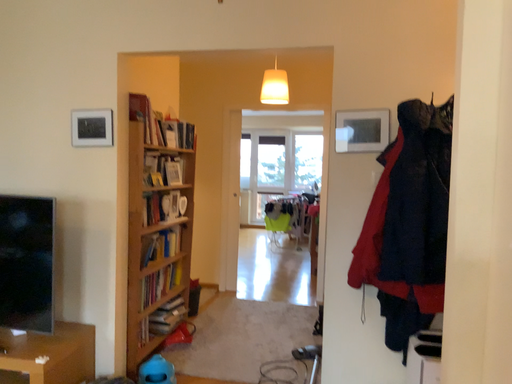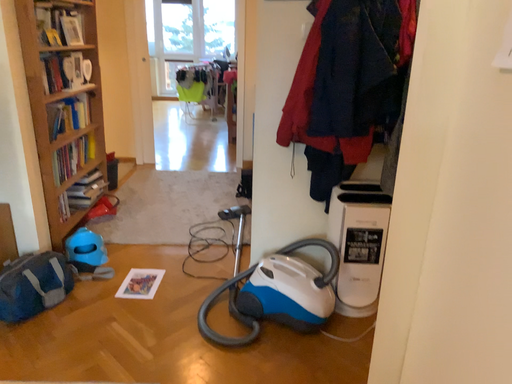
Question: How did the camera likely rotate when shooting the video?

Choices:
 (A) rotated right
 (B) rotated left

Answer: (A)